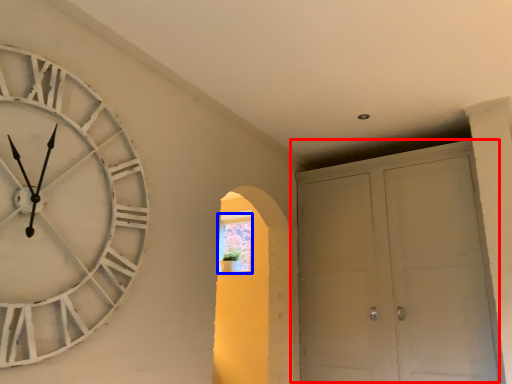
Question: Which object appears closest to the camera in this image, door (highlighted by a red box) or window (highlighted by a blue box)?

Choices:
 (A) door
 (B) window

Answer: (A)